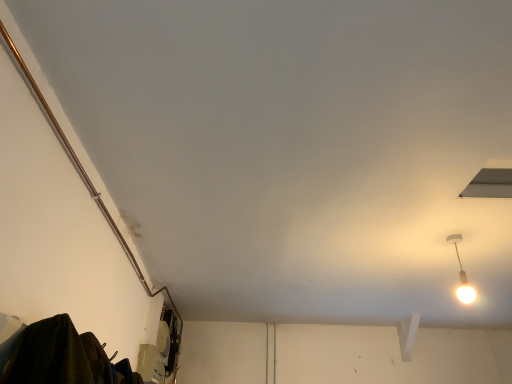
Looking at this image, measure the distance between point (453, 242) and camera.

They are 7.81 feet apart.

Where is `matte white bulb at upper right`? matte white bulb at upper right is located at coordinates (462, 275).

The height and width of the screenshot is (384, 512). Describe the element at coordinates (462, 275) in the screenshot. I see `matte white bulb at upper right` at that location.

Where is `matte white bulb at upper right`? matte white bulb at upper right is located at coordinates (462, 275).